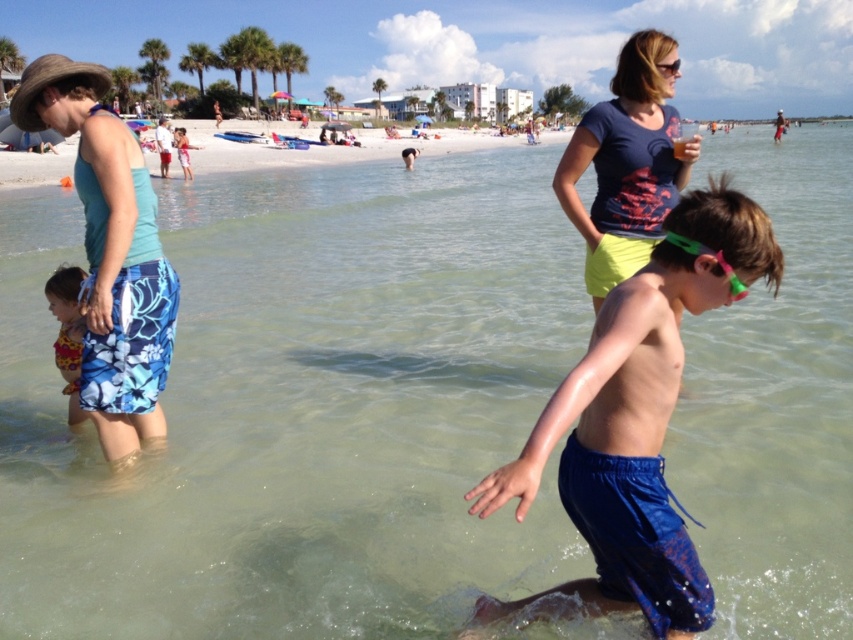
Question: Is blue fabric shorts at center positioned at the back of teal fabric tank top at left?

Choices:
 (A) no
 (B) yes

Answer: (A)

Question: Is the position of blue fabric shorts at center more distant than that of printed fabric swimsuit at lower left?

Choices:
 (A) no
 (B) yes

Answer: (A)

Question: Which object appears closest to the camera in this image?

Choices:
 (A) matte blue t-shirt at upper center
 (B) blue fabric shorts at center
 (C) white sand beach at center

Answer: (B)

Question: Which is farther from the matte blue t-shirt at upper center?

Choices:
 (A) blue fabric shorts at center
 (B) printed fabric swimsuit at lower left

Answer: (B)

Question: Among these points, which one is farthest from the camera?

Choices:
 (A) (57, 268)
 (B) (115, 125)

Answer: (A)

Question: Is teal fabric tank top at left wider than white sand beach at center?

Choices:
 (A) no
 (B) yes

Answer: (A)